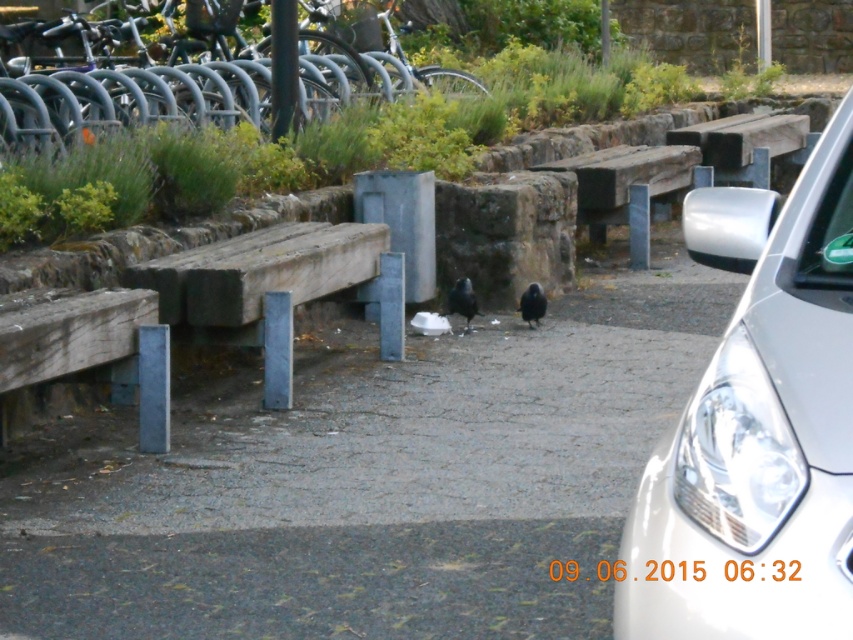
Does weathered wood bench at lower left appear on the right side of wooden bench at center?

No, weathered wood bench at lower left is not to the right of wooden bench at center.

Is weathered wood bench at lower left thinner than wooden bench at center?

Indeed, weathered wood bench at lower left has a lesser width compared to wooden bench at center.

This screenshot has height=640, width=853. Identify the location of weathered wood bench at lower left. (96, 349).

Does black matte bird at center have a lesser width compared to black matte pigeon at center?

No.

Which is in front, point (459, 280) or point (529, 292)?

Point (529, 292) is more forward.

Locate an element on the screen. This screenshot has width=853, height=640. black matte bird at center is located at coordinates (462, 300).

Does white glossy car at right have a greater height compared to weathered wood bench at center?

In fact, white glossy car at right may be shorter than weathered wood bench at center.

What do you see at coordinates (758, 428) in the screenshot? The height and width of the screenshot is (640, 853). I see `white glossy car at right` at bounding box center [758, 428].

Find the location of a particular element. white glossy car at right is located at coordinates (758, 428).